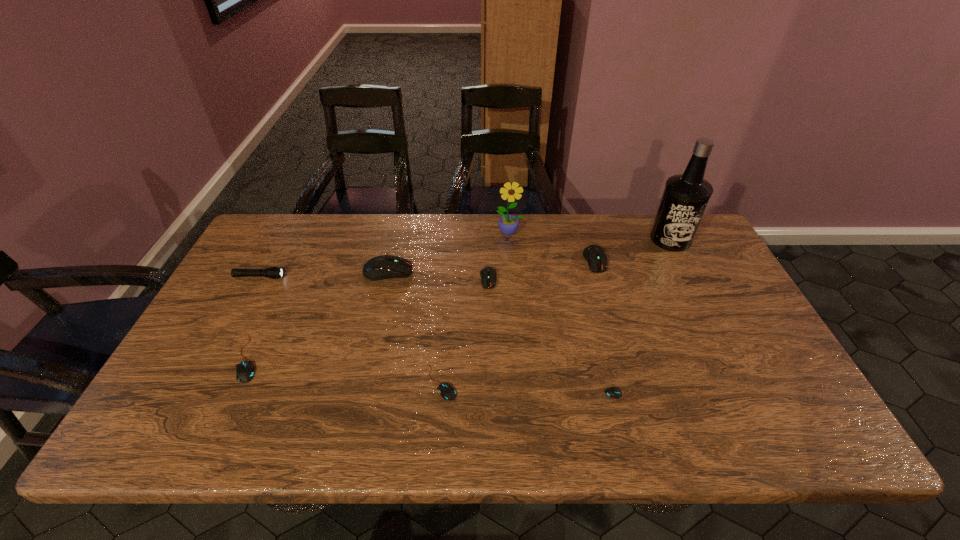
At what (x,y) coordinates should I click in order to perform the action: click on the second dark computer equipment from right to left. Please return your answer as a coordinate pair (x, y). Looking at the image, I should click on (488, 274).

This screenshot has height=540, width=960. Find the location of `the leftmost black mouse`. the leftmost black mouse is located at coordinates (245, 370).

Where is `the biggest black mouse`? Image resolution: width=960 pixels, height=540 pixels. the biggest black mouse is located at coordinates (245, 370).

You are a GUI agent. You are given a task and a screenshot of the screen. Output one action in this format:
    pyautogui.click(x=<x>, y=<y>)
    Task: Click on the sixth object from right to left
    The width and height of the screenshot is (960, 540).
    Given the screenshot: What is the action you would take?
    pyautogui.click(x=447, y=391)

Locate an element on the screen. The image size is (960, 540). the second shortest mouse is located at coordinates (447, 391).

Where is `the shortest object`? The height and width of the screenshot is (540, 960). the shortest object is located at coordinates (613, 392).

Identify the location of the rightmost black mouse. The height and width of the screenshot is (540, 960). (613, 392).

The image size is (960, 540). Identify the location of free space located 0.060m on the front label of the liquor. (684, 265).

Image resolution: width=960 pixels, height=540 pixels. In order to click on free space located on the front-facing side of the sunflower in this screenshot , I will do [515, 287].

The image size is (960, 540). What are the coordinates of `vacant position located 0.360m on the button of the tallest mouse` in the screenshot? It's located at pyautogui.click(x=531, y=272).